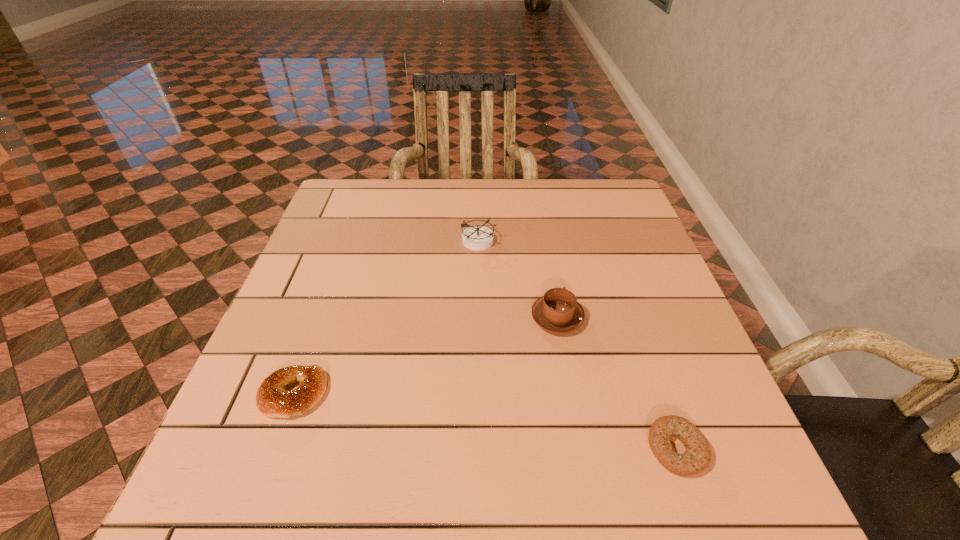
I want to click on free space at the near left corner of the desktop, so click(x=278, y=521).

Find the location of a particular element. free location at the far right corner of the desktop is located at coordinates (632, 212).

In order to click on vacant space at the near right corner in this screenshot , I will do `click(710, 503)`.

Identify the location of vacant area that lies between the third object from left to right and the farthest object. (518, 279).

Identify the location of free space between the third nearest object and the rightmost object. The image size is (960, 540). (616, 383).

You are a GUI agent. You are given a task and a screenshot of the screen. Output one action in this format:
    pyautogui.click(x=<x>, y=<y>)
    Task: Click on the vacant space in between the cappuccino and the left bagel
    
    Given the screenshot: What is the action you would take?
    pyautogui.click(x=425, y=356)

This screenshot has height=540, width=960. Find the location of `vacant area that lies between the left bagel and the farthest object`. vacant area that lies between the left bagel and the farthest object is located at coordinates (387, 318).

Where is `vacant space that is in between the compass and the second farthest object`? vacant space that is in between the compass and the second farthest object is located at coordinates (518, 279).

Where is `free space that is in between the second object from right to left and the farthest object`? free space that is in between the second object from right to left and the farthest object is located at coordinates (518, 279).

You are a GUI agent. You are given a task and a screenshot of the screen. Output one action in this format:
    pyautogui.click(x=<x>, y=<y>)
    Task: Click on the free space between the compass and the leftmost object
    
    Given the screenshot: What is the action you would take?
    pyautogui.click(x=387, y=318)